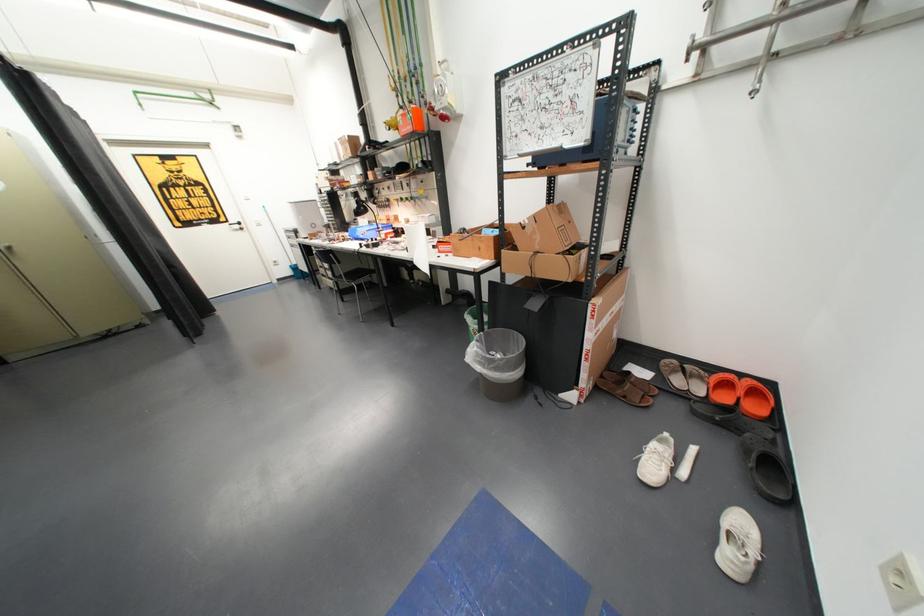
Find where to plugg the power outlet socket. Please return your answer as a coordinate pair (x, y).

(902, 582)